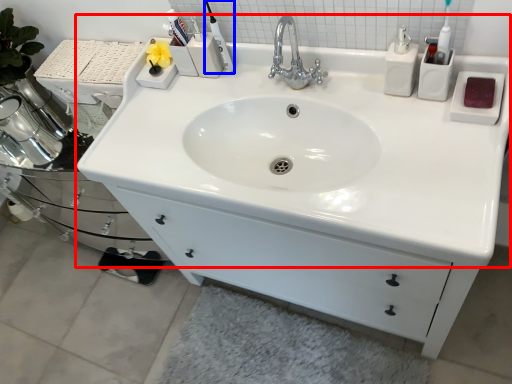
Question: Which point is closer to the camera, sink (highlighted by a red box) or toiletry (highlighted by a blue box)?

Choices:
 (A) sink
 (B) toiletry

Answer: (A)